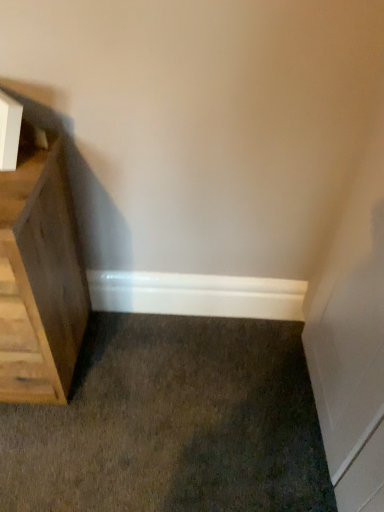
Looking at this image, in order to face white smooth baseboard at lower center, should I rotate leftwards or rightwards?

It's best to rotate right around 0.325 degrees.

What are the coordinates of `white smooth baseboard at lower center` in the screenshot? It's located at (197, 294).

Describe the element at coordinates (197, 294) in the screenshot. The width and height of the screenshot is (384, 512). I see `white smooth baseboard at lower center` at that location.

The width and height of the screenshot is (384, 512). In order to click on white smooth baseboard at lower center in this screenshot , I will do `click(197, 294)`.